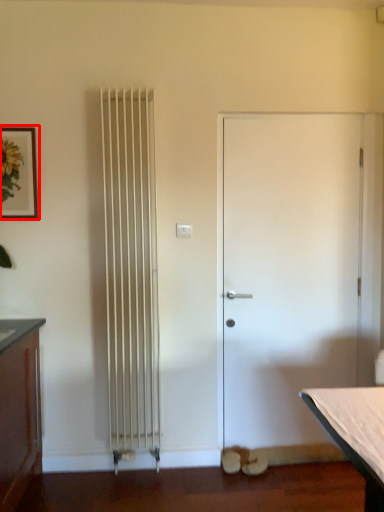
Question: From the image's perspective, where is picture frame (annotated by the red box) located relative to door?

Choices:
 (A) below
 (B) above

Answer: (B)